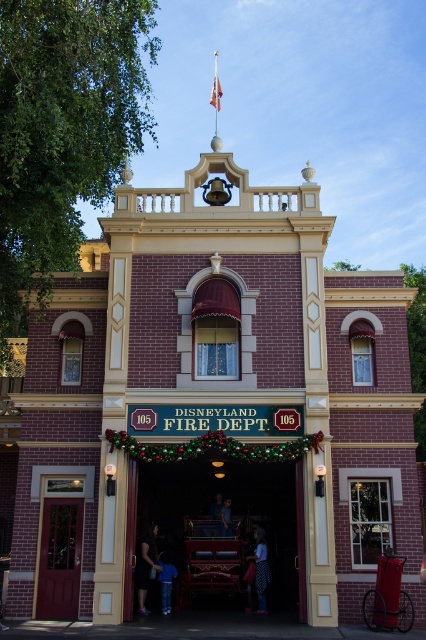
You are standing in front of the Disneyland Fire Department building and want to take a photo. You notice two points marked on the building at coordinates point (x=66, y=556) and point (x=161, y=589). Which point will appear larger in your camera view?

Point (x=66, y=556) is closer to the camera than point (x=161, y=589), so it will appear larger in the photo.

You are standing in front of the Disneyland Fire Department building and notice both the shiny red fire truck at center and the dotted fabric dress at center. Which object is closer to you?

The shiny red fire truck at center is closer to you since it is in front of the dotted fabric dress at center.

You are standing in front of the Disneyland Fire Department building and notice the matte red door at center and the blue denim jeans at lower center. Which object is nearer to you?

The matte red door at center is closer to the viewer than the blue denim jeans at lower center.